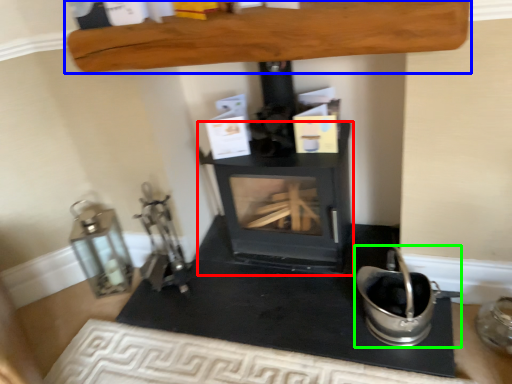
Question: Based on their relative distances, which object is farther from wood burning stove (highlighted by a red box)? Choose from furniture (highlighted by a blue box) and appliance (highlighted by a green box).

Choices:
 (A) furniture
 (B) appliance

Answer: (A)